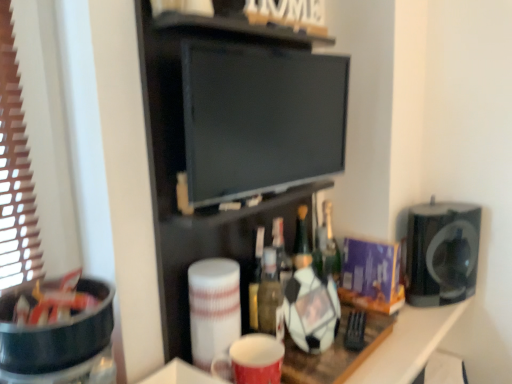
Find the location of `vacant area situated below black matte speaker at right, the 2th appliance positioned from the left (from a real-world perspective)`. vacant area situated below black matte speaker at right, the 2th appliance positioned from the left (from a real-world perspective) is located at coordinates (444, 298).